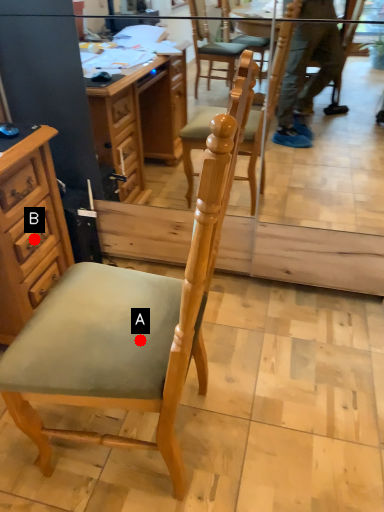
Question: Two points are circled on the image, labeled by A and B beside each circle. Which point is closer to the camera?

Choices:
 (A) A is closer
 (B) B is closer

Answer: (A)